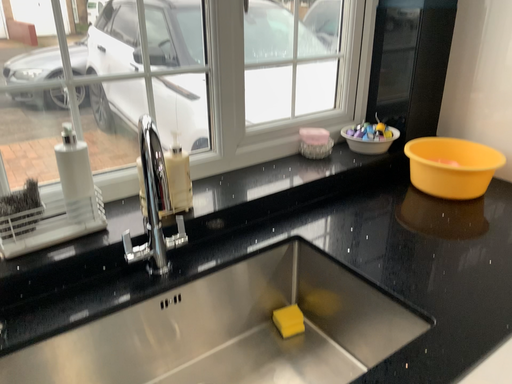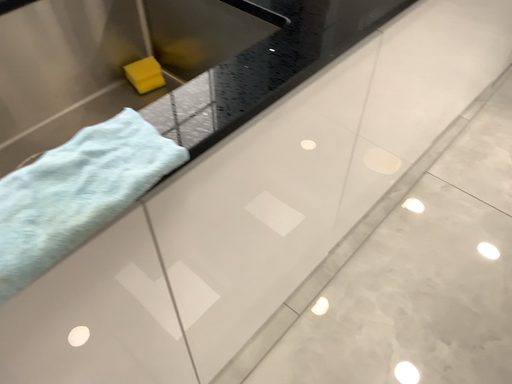
Question: Which way did the camera rotate in the video?

Choices:
 (A) rotated left
 (B) rotated right

Answer: (B)